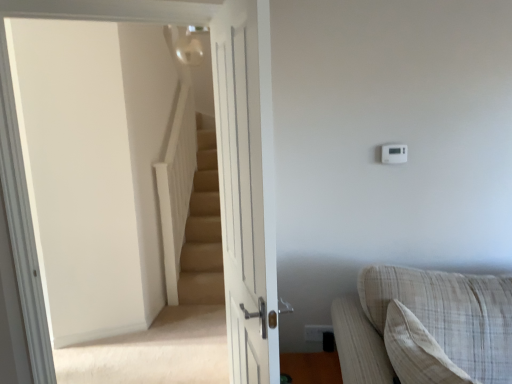
Locate an element on the screen. This screenshot has height=384, width=512. white plastic thermostat at upper right is located at coordinates (394, 154).

This screenshot has width=512, height=384. Describe the element at coordinates (247, 187) in the screenshot. I see `white wooden door at center` at that location.

Where is `beige carpeted stairs at upper left`? Image resolution: width=512 pixels, height=384 pixels. beige carpeted stairs at upper left is located at coordinates (172, 306).

From the image's perspective, who appears lower, beige carpeted stairs at upper left or white wooden door at center?

white wooden door at center is shown below in the image.

Considering the sizes of objects beige carpeted stairs at upper left and white wooden door at center in the image provided, who is thinner, beige carpeted stairs at upper left or white wooden door at center?

Thinner between the two is white wooden door at center.

Is beige carpeted stairs at upper left next to white wooden door at center?

No, beige carpeted stairs at upper left is not in contact with white wooden door at center.

From a real-world perspective, is beige carpeted stairs at upper left physically located above or below white wooden door at center?

Clearly, from a real-world perspective, beige carpeted stairs at upper left is above white wooden door at center.

Based on the photo, which of these two, white plastic electric outlet at upper right or white wooden door at center, is bigger?

white wooden door at center.

Can you confirm if white plastic electric outlet at upper right is thinner than white wooden door at center?

Yes.

Between white plastic electric outlet at upper right and white wooden door at center, which one appears on the right side from the viewer's perspective?

From the viewer's perspective, white plastic electric outlet at upper right appears more on the right side.

From the image's perspective, is white plastic electric outlet at upper right over beige fabric couch at lower right?

Actually, white plastic electric outlet at upper right appears below beige fabric couch at lower right in the image.

Can you confirm if white plastic electric outlet at upper right is bigger than beige fabric couch at lower right?

Actually, white plastic electric outlet at upper right might be smaller than beige fabric couch at lower right.

From the picture: From a real-world perspective, is white plastic electric outlet at upper right on top of beige fabric couch at lower right?

No.

Is white plastic electric outlet at upper right not close to beige fabric couch at lower right?

No.

Is white plastic thermostat at upper right positioned far away from beige carpeted stairs at upper left?

Yes, white plastic thermostat at upper right is far from beige carpeted stairs at upper left.

Measure the distance from white plastic thermostat at upper right to beige carpeted stairs at upper left.

They are 6.87 feet apart.

Which object is closer to the camera taking this photo, white plastic thermostat at upper right or beige carpeted stairs at upper left?

Positioned in front is beige carpeted stairs at upper left.

How many degrees apart are the facing directions of white plastic thermostat at upper right and beige carpeted stairs at upper left?

white plastic thermostat at upper right and beige carpeted stairs at upper left are facing 31.8 degrees away from each other.

From a real-world perspective, is beige fabric couch at lower right above or below white wooden door at center?

beige fabric couch at lower right is below white wooden door at center.

Which object is closer to the camera taking this photo, beige fabric couch at lower right or white wooden door at center?

beige fabric couch at lower right.

Looking at this image, from the image's perspective, is beige fabric couch at lower right beneath white wooden door at center?

Correct, beige fabric couch at lower right appears lower than white wooden door at center in the image.

Who is shorter, beige fabric couch at lower right or white wooden door at center?

Standing shorter between the two is beige fabric couch at lower right.

Is white plastic thermostat at upper right positioned with its back to white wooden door at center?

white plastic thermostat at upper right is not turned away from white wooden door at center.

Considering the relative sizes of white plastic thermostat at upper right and white wooden door at center in the image provided, is white plastic thermostat at upper right shorter than white wooden door at center?

Yes, white plastic thermostat at upper right is shorter than white wooden door at center.

Considering the relative sizes of white plastic thermostat at upper right and white wooden door at center in the image provided, is white plastic thermostat at upper right wider than white wooden door at center?

Incorrect, the width of white plastic thermostat at upper right does not surpass that of white wooden door at center.

Which object is more forward, beige fabric couch at lower right or white plastic thermostat at upper right?

beige fabric couch at lower right is closer to the camera.

Is beige fabric couch at lower right positioned far away from white plastic thermostat at upper right?

Actually, beige fabric couch at lower right and white plastic thermostat at upper right are a little close together.

Does point (496, 380) come behind point (396, 163)?

No, (496, 380) is in front of (396, 163).

The image size is (512, 384). What are the coordinates of `door located in front of the beige carpeted stairs at upper left` in the screenshot? It's located at (247, 187).

Locate an element on the screen. The height and width of the screenshot is (384, 512). door on the left of white plastic electric outlet at upper right is located at coordinates (247, 187).

Considering their positions, is beige fabric couch at lower right positioned closer to white wooden door at center than white plastic thermostat at upper right?

beige fabric couch at lower right is positioned closer to the anchor white wooden door at center.

Estimate the real-world distances between objects in this image. Which object is closer to white plastic electric outlet at upper right, white plastic thermostat at upper right or beige carpeted stairs at upper left?

white plastic thermostat at upper right lies closer to white plastic electric outlet at upper right than the other object.

Estimate the real-world distances between objects in this image. Which object is closer to beige fabric couch at lower right, white plastic electric outlet at upper right or white wooden door at center?

Based on the image, white plastic electric outlet at upper right appears to be nearer to beige fabric couch at lower right.

Looking at the image, which one is located closer to beige fabric couch at lower right, beige carpeted stairs at upper left or white wooden door at center?

Among the two, white wooden door at center is located nearer to beige fabric couch at lower right.

Considering their positions, is white plastic thermostat at upper right positioned further to beige carpeted stairs at upper left than white wooden door at center?

Based on the image, white plastic thermostat at upper right appears to be further to beige carpeted stairs at upper left.

Which object lies further to the anchor point white wooden door at center, white plastic electric outlet at upper right or beige carpeted stairs at upper left?

beige carpeted stairs at upper left lies further to white wooden door at center than the other object.

Which object lies further to the anchor point white plastic electric outlet at upper right, white wooden door at center or beige fabric couch at lower right?

white wooden door at center.

Considering their positions, is white plastic electric outlet at upper right positioned further to white plastic thermostat at upper right than beige carpeted stairs at upper left?

beige carpeted stairs at upper left is positioned further to the anchor white plastic thermostat at upper right.

Locate an element on the screen. electric outlet between beige carpeted stairs at upper left and white plastic thermostat at upper right from left to right is located at coordinates (316, 332).

In order to click on door located between beige fabric couch at lower right and white plastic electric outlet at upper right in the depth direction in this screenshot , I will do `click(247, 187)`.

The height and width of the screenshot is (384, 512). In order to click on door between beige fabric couch at lower right and white plastic thermostat at upper right along the z-axis in this screenshot , I will do `click(247, 187)`.

Where is `electric outlet between beige carpeted stairs at upper left and beige fabric couch at lower right from left to right`? Image resolution: width=512 pixels, height=384 pixels. electric outlet between beige carpeted stairs at upper left and beige fabric couch at lower right from left to right is located at coordinates (316, 332).